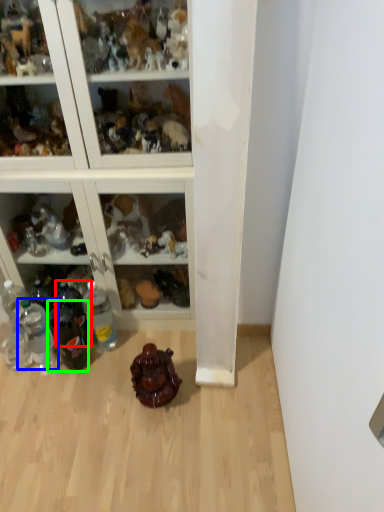
Question: Which object is positioned closest to bottle (highlighted by a red box)? Select from bottle (highlighted by a blue box) and bottle (highlighted by a green box).

Choices:
 (A) bottle
 (B) bottle

Answer: (B)